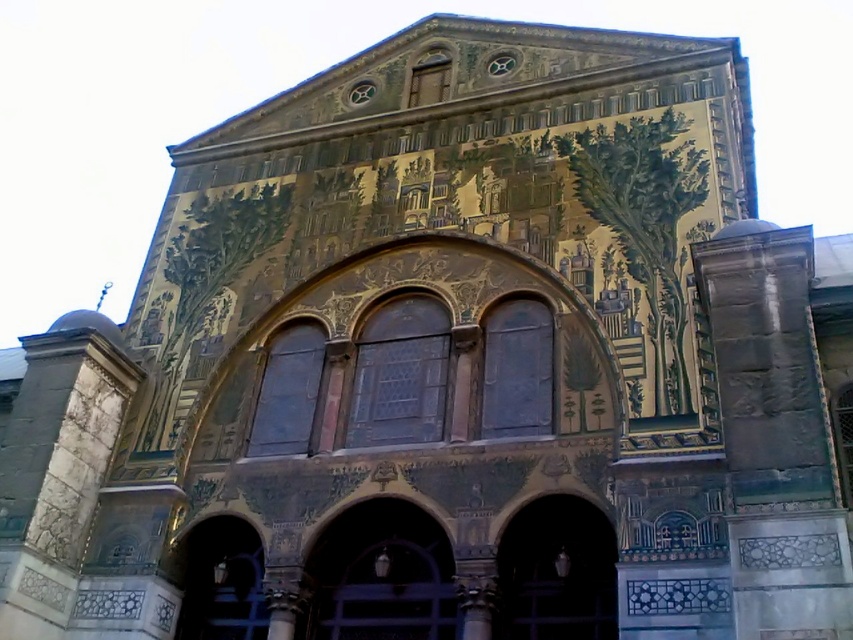
From the picture: You are standing in front of the grand building and want to place a small decorative statue between the two points, point (564, 579) and point (206, 596). Which point should the statue be closer to in order to be in front of the building?

The statue should be closer to point (564, 579) because it is in front of point (206, 596).

You are standing in front of the grand building and want to enter through one of the doors. Which door is more accessible to you, the black glass door at center or the dark wood door at lower left?

The black glass door at center is closer to the viewer than the dark wood door at lower left, so it is more accessible.